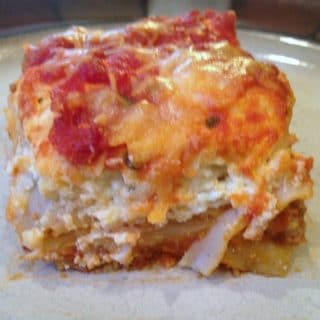
Locate an element on the screen. plate is located at coordinates (45, 302).